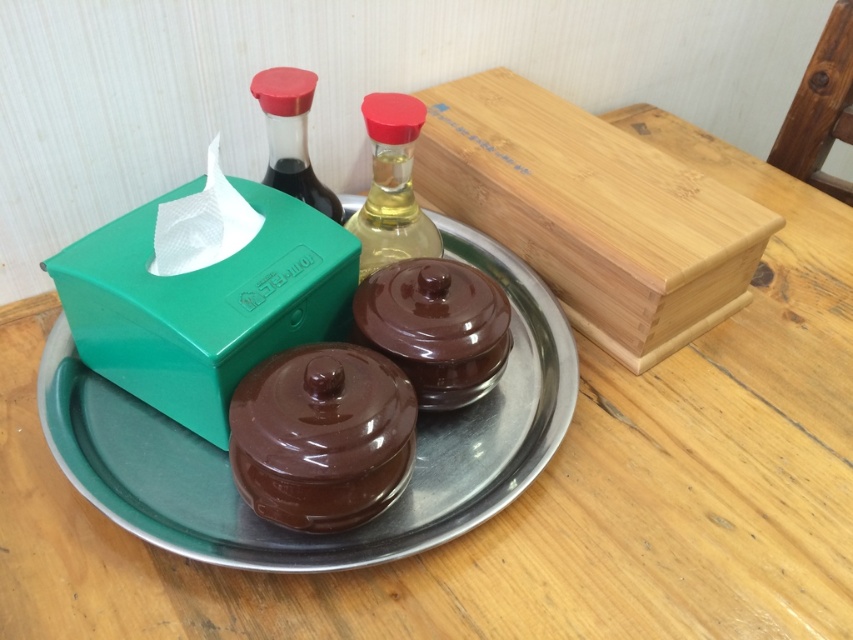
You are setting up a dinner table and need to place a 12 cm diameter dessert plate. You have the metallic silver plate at center and the translucent glass bottle at center on the table. Which item can accommodate the dessert plate underneath it without the plate falling off?

The metallic silver plate at center has a larger size compared to the translucent glass bottle at center, so the dessert plate can be placed underneath the metallic silver plate at center as it provides a stable and larger surface area.

You are a guest at a dinner party and want to reach the wooden box at upper right to take a tissue. However, there is a glossy brown chocolate cake at center in the way. Can you move around the cake to access the box?

The wooden box at upper right is located above the glossy brown chocolate cake at center, so you can easily move around the cake to access the box since it is positioned higher and not blocking the path directly below.